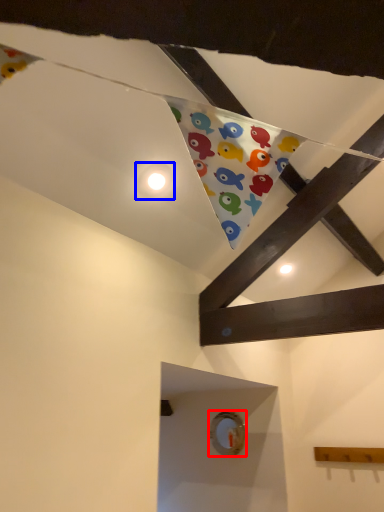
Question: Which of the following is the closest to the observer, button (highlighted by a red box) or button (highlighted by a blue box)?

Choices:
 (A) button
 (B) button

Answer: (B)